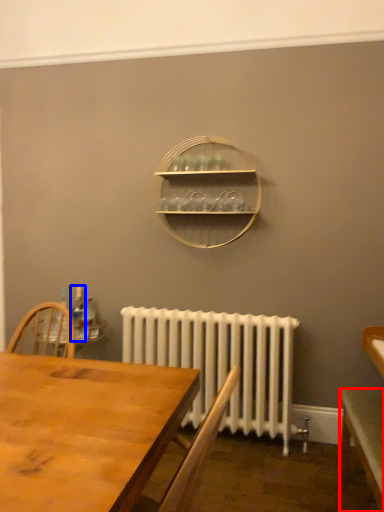
Question: Which point is further to the camera, table (highlighted by a red box) or bottle (highlighted by a blue box)?

Choices:
 (A) table
 (B) bottle

Answer: (B)